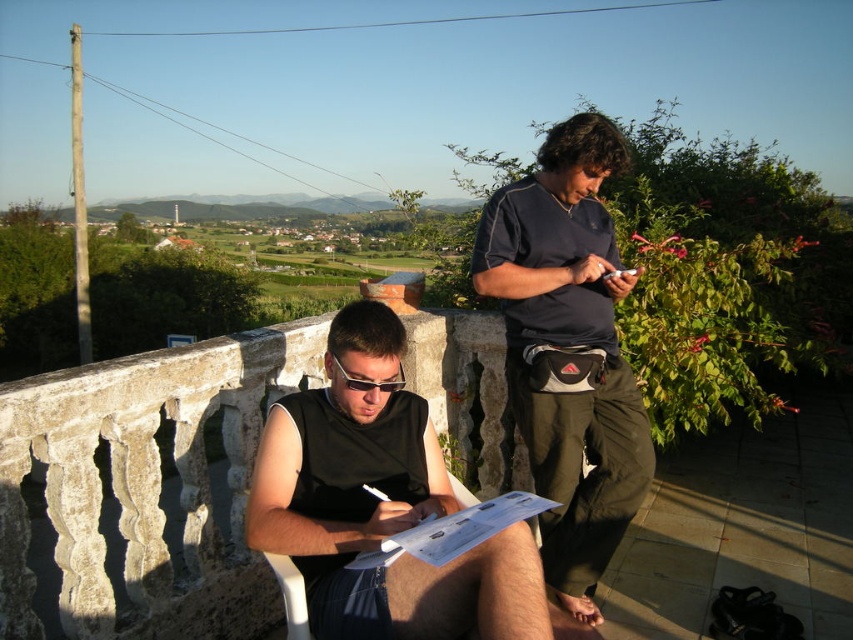
Question: Which point is closer to the camera?

Choices:
 (A) (621, 484)
 (B) (361, 524)

Answer: (B)

Question: Is black matte vest at center positioned in front of dark blue fabric shirt at upper center?

Choices:
 (A) yes
 (B) no

Answer: (A)

Question: Does black matte vest at center appear on the right side of dark blue fabric shirt at upper center?

Choices:
 (A) no
 (B) yes

Answer: (A)

Question: Is black matte vest at center thinner than dark blue fabric shirt at upper center?

Choices:
 (A) no
 (B) yes

Answer: (A)